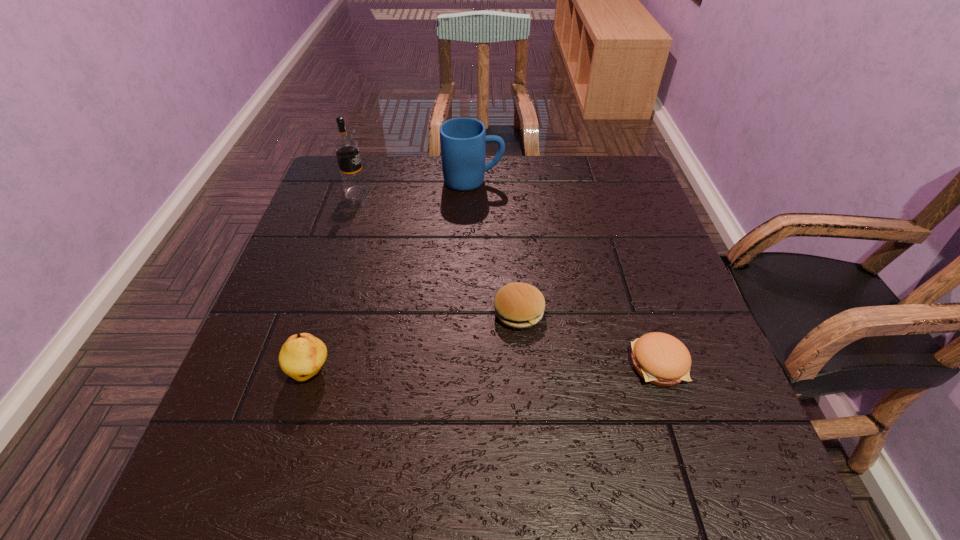
Identify the location of empty location between the nearer patty and the third tallest object. This screenshot has width=960, height=540. (485, 368).

Where is `free space between the nearer patty and the left patty`? free space between the nearer patty and the left patty is located at coordinates (588, 338).

At what (x,y) coordinates should I click in order to perform the action: click on free space between the mug and the nearer patty. Please return your answer as a coordinate pair (x, y). The image size is (960, 540). Looking at the image, I should click on (565, 273).

You are a GUI agent. You are given a task and a screenshot of the screen. Output one action in this format:
    pyautogui.click(x=<x>, y=<y>)
    Task: Click on the vacant area between the fourth shortest object and the pear
    This screenshot has width=960, height=540.
    Given the screenshot: What is the action you would take?
    pyautogui.click(x=392, y=276)

You are a GUI agent. You are given a task and a screenshot of the screen. Output one action in this format:
    pyautogui.click(x=<x>, y=<y>)
    Task: Click on the free point between the mug and the rightmost object
    This screenshot has width=960, height=540.
    Given the screenshot: What is the action you would take?
    pyautogui.click(x=565, y=273)

Identify which object is the third closest to the right patty. Please provide its 2D coordinates. Your answer should be formatted as a tuple, i.e. [(x, y)], where the tuple contains the x and y coordinates of a point satisfying the conditions above.

[(302, 356)]

Locate an element on the screen. This screenshot has width=960, height=540. object that stands as the second closest to the right patty is located at coordinates (463, 140).

Where is `vacant space that satisfies the following two spatial constraints: 1. on the label of the third tallest object; 2. on the left side of the vodka`? vacant space that satisfies the following two spatial constraints: 1. on the label of the third tallest object; 2. on the left side of the vodka is located at coordinates (298, 372).

Find the location of a particular element. Image resolution: width=960 pixels, height=540 pixels. vacant space that satisfies the following two spatial constraints: 1. on the back side of the nearer patty; 2. on the label of the vodka is located at coordinates (602, 192).

This screenshot has width=960, height=540. I want to click on vacant space that satisfies the following two spatial constraints: 1. on the side of the nearer patty with the handle; 2. on the right side of the second tallest object, so click(x=469, y=364).